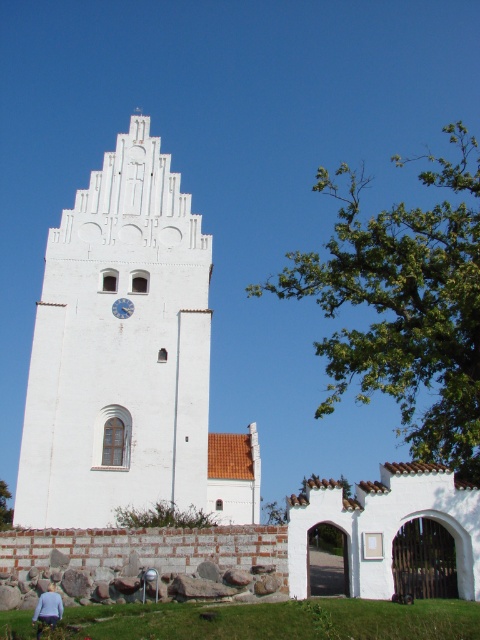
Who is positioned more to the right, white stone church at center or green leafy tree at upper center?

From the viewer's perspective, white stone church at center appears more on the right side.

Who is taller, white stone church at center or green leafy tree at upper center?

With more height is white stone church at center.

Is point (67, 260) more distant than point (12, 512)?

No, it is not.

Identify the location of white stone church at center. (128, 358).

Can you confirm if green leafy tree at upper right is bigger than green leafy tree at upper center?

Yes.

Is point (450, 448) closer to camera compared to point (10, 513)?

Yes, it is.

Find the location of a particular element. Image resolution: width=480 pixels, height=640 pixels. green leafy tree at upper right is located at coordinates (405, 305).

How much distance is there between white stone church at center and green leafy tree at upper right?

white stone church at center is 21.53 meters from green leafy tree at upper right.

This screenshot has width=480, height=640. What do you see at coordinates (128, 358) in the screenshot? I see `white stone church at center` at bounding box center [128, 358].

Is point (248, 502) positioned after point (429, 186)?

No, it is not.

At what (x,y) coordinates should I click in order to perform the action: click on white stone church at center. Please return your answer as a coordinate pair (x, y). The image size is (480, 640). Looking at the image, I should click on (128, 358).